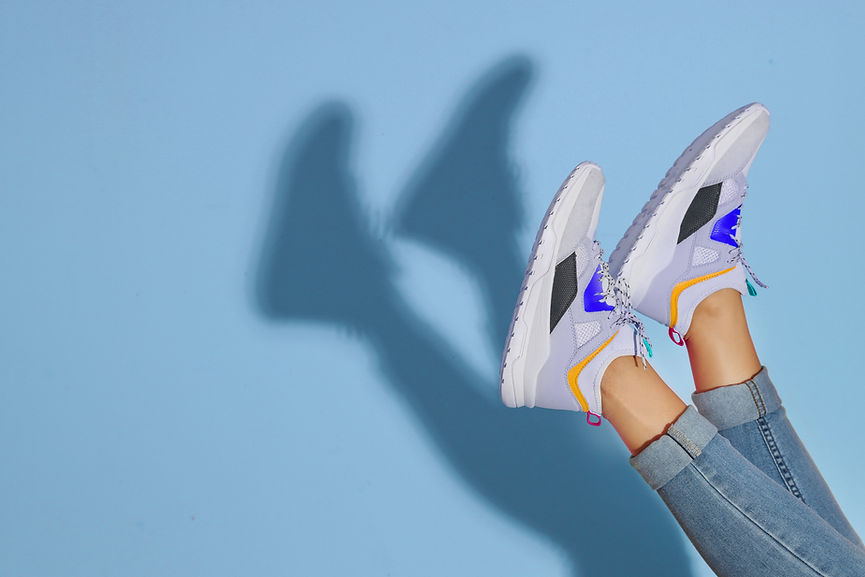
Identify the location of light blue wall color. The height and width of the screenshot is (577, 865). (151, 422).